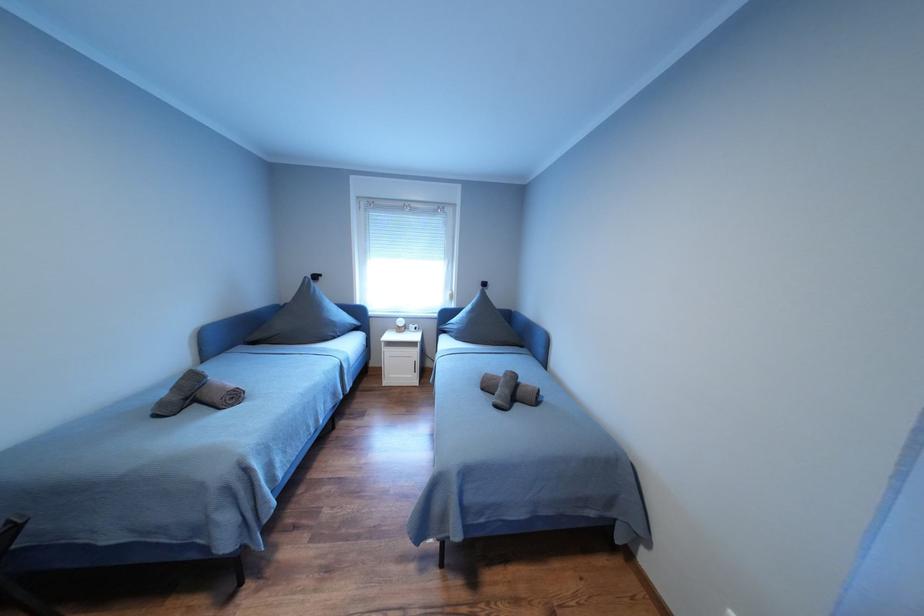
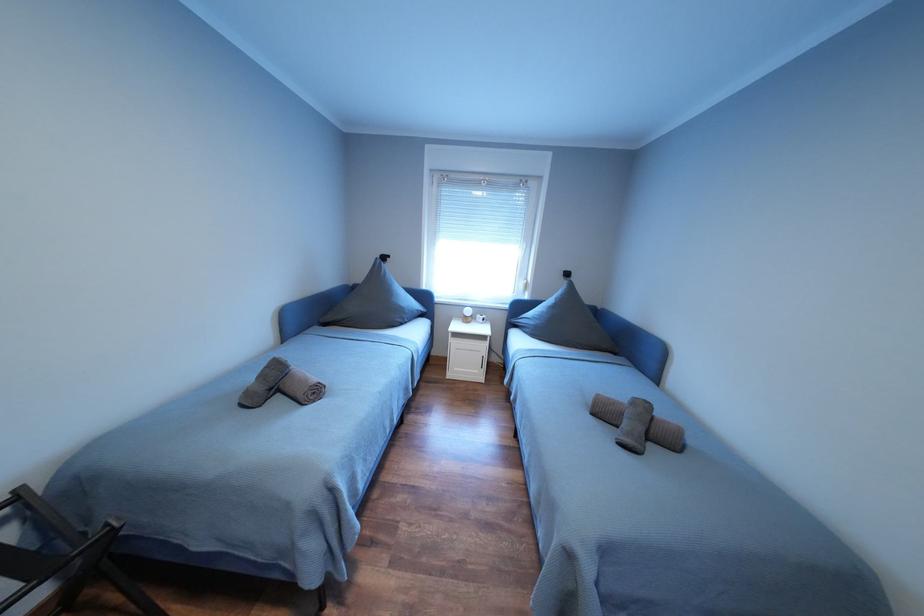
Question: How did the camera likely rotate?

Choices:
 (A) Left
 (B) Right
 (C) Up
 (D) Down

Answer: (A)